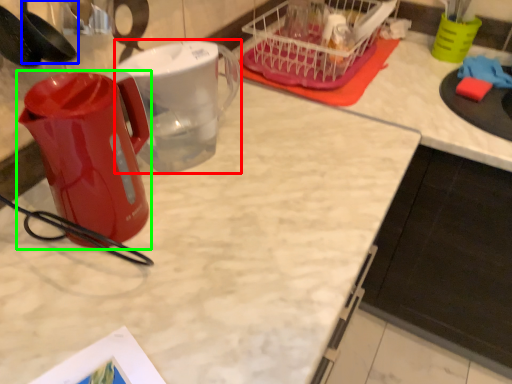
Question: Which object is the closest to the pitcher (highlighted by a red box)? Choose among these: spoon (highlighted by a blue box) or kettle (highlighted by a green box).

Choices:
 (A) spoon
 (B) kettle

Answer: (B)